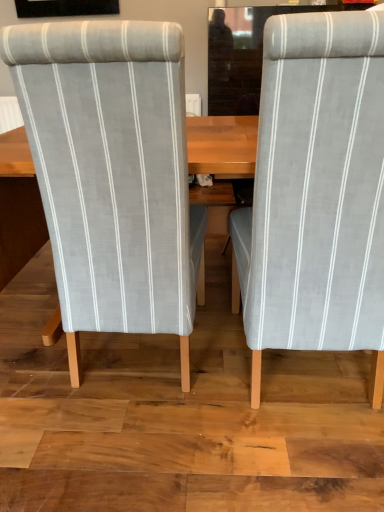
Question: From the image's perspective, is gray fabric chair at right, which is the 1th chair in right-to-left order, positioned above or below light gray striped fabric chair at left, which appears as the first chair when viewed from the left?

Choices:
 (A) above
 (B) below

Answer: (B)

Question: Does point (283, 201) appear closer or farther from the camera than point (114, 293)?

Choices:
 (A) farther
 (B) closer

Answer: (B)

Question: Considering the relative positions of gray fabric chair at right, which is the 1th chair in right-to-left order, and light gray striped fabric chair at left, which appears as the first chair when viewed from the left, in the image provided, is gray fabric chair at right, which is the 1th chair in right-to-left order, to the left or to the right of light gray striped fabric chair at left, which appears as the first chair when viewed from the left,?

Choices:
 (A) left
 (B) right

Answer: (B)

Question: Considering the positions of point (110, 31) and point (299, 329), is point (110, 31) closer or farther from the camera than point (299, 329)?

Choices:
 (A) closer
 (B) farther

Answer: (A)

Question: From a real-world perspective, is light gray striped fabric chair at left, the second chair from the right, above or below gray fabric chair at right, the second chair positioned from the left?

Choices:
 (A) above
 (B) below

Answer: (B)

Question: In the image, is light gray striped fabric chair at left, the second chair from the right, on the left side or the right side of gray fabric chair at right, the second chair positioned from the left?

Choices:
 (A) left
 (B) right

Answer: (A)

Question: From the image's perspective, is light gray striped fabric chair at left, the second chair from the right, located above or below gray fabric chair at right, the second chair positioned from the left?

Choices:
 (A) above
 (B) below

Answer: (A)